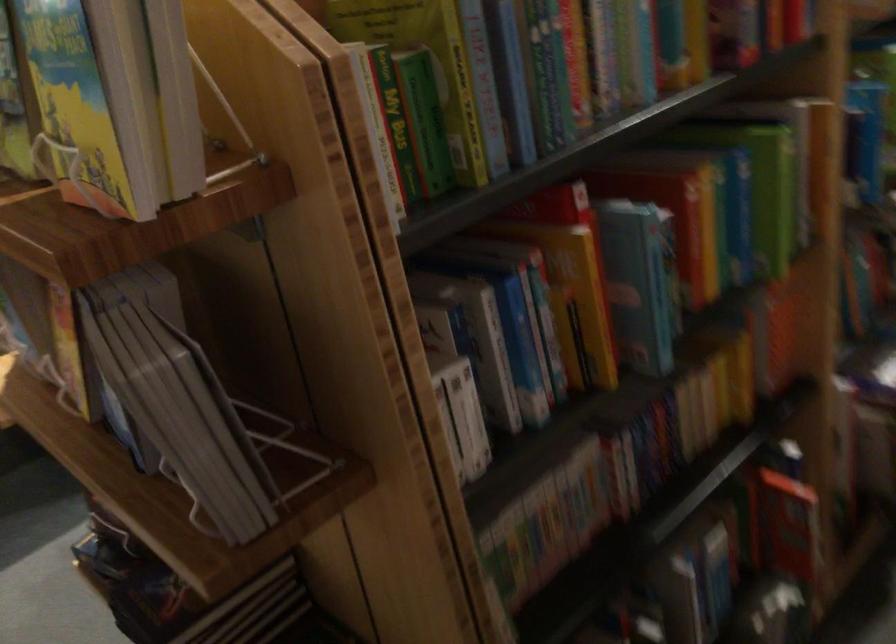
Where is `white cup handle`? white cup handle is located at coordinates (52, 147).